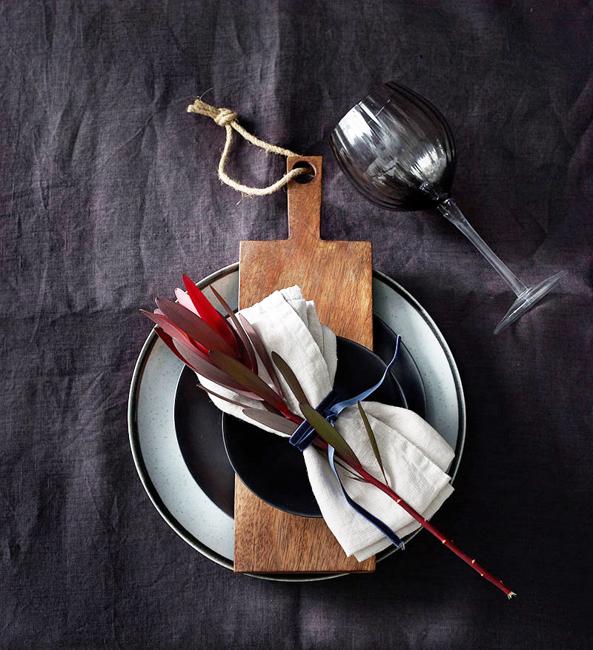
Find the location of `bottom of glass`. bottom of glass is located at coordinates (527, 300).